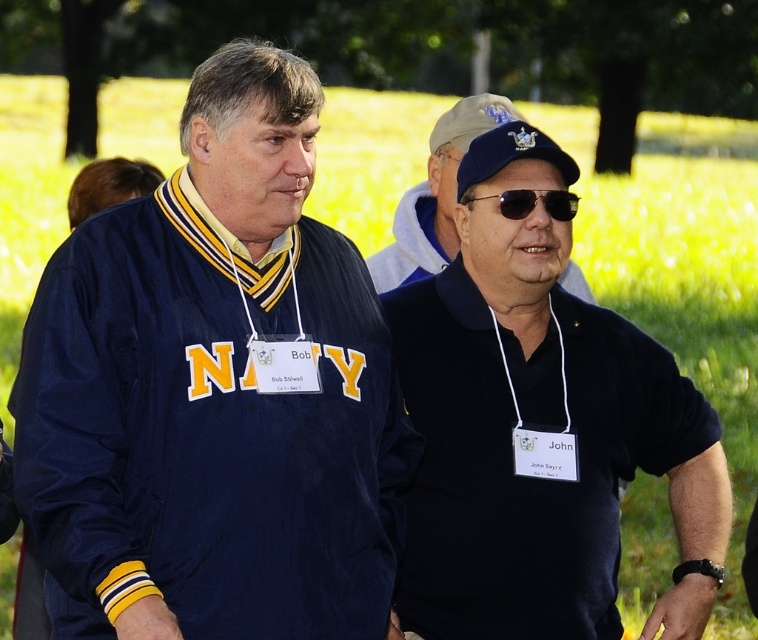
Question: Which point is closer to the camera taking this photo?

Choices:
 (A) (393, 232)
 (B) (550, 420)
 (C) (506, 193)

Answer: (C)

Question: Can you confirm if navy fabric jacket at left is wider than black matte shirt at right?

Choices:
 (A) no
 (B) yes

Answer: (B)

Question: Which point is closer to the camera taking this photo?

Choices:
 (A) (520, 547)
 (B) (143, 474)
 (C) (443, 164)
 (D) (559, 189)

Answer: (B)

Question: Which is nearer to the black matte shirt at right?

Choices:
 (A) black matte cap at upper center
 (B) navy fabric jacket at left
 (C) blue fabric baseball cap at center
 (D) black reflective sunglasses at center

Answer: (D)

Question: Is black matte cap at upper center smaller than blue fabric baseball cap at center?

Choices:
 (A) yes
 (B) no

Answer: (A)

Question: Is navy fabric jacket at left below black matte shirt at right?

Choices:
 (A) yes
 (B) no

Answer: (B)